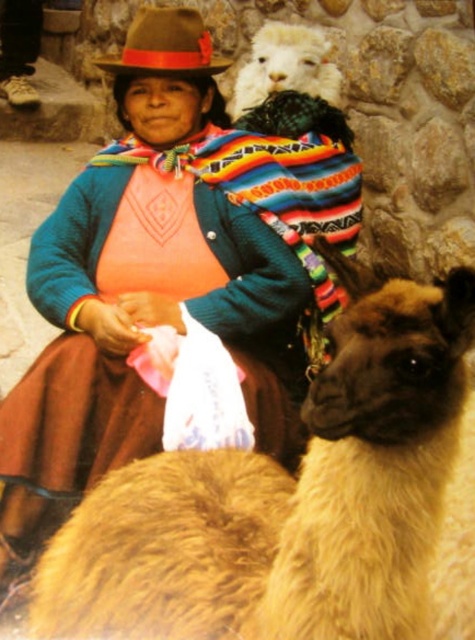
Question: Which object is positioned closest to the white woolen alpaca at upper center?

Choices:
 (A) brown felt hat at upper center
 (B) fuzzy beige alpaca at center

Answer: (A)

Question: Is fuzzy beige alpaca at center to the right of white woolen alpaca at upper center from the viewer's perspective?

Choices:
 (A) yes
 (B) no

Answer: (B)

Question: Does knitted wool sweater at center have a smaller size compared to brown felt hat at upper center?

Choices:
 (A) no
 (B) yes

Answer: (A)

Question: Which object appears farthest from the camera in this image?

Choices:
 (A) fuzzy beige alpaca at center
 (B) brown felt hat at upper center
 (C) knitted wool sweater at center

Answer: (B)

Question: Is knitted wool sweater at center to the left of brown felt hat at upper center from the viewer's perspective?

Choices:
 (A) no
 (B) yes

Answer: (A)

Question: Which of the following is the closest to the observer?

Choices:
 (A) fuzzy beige alpaca at center
 (B) knitted wool sweater at center
 (C) white woolen alpaca at upper center
 (D) brown felt hat at upper center

Answer: (A)